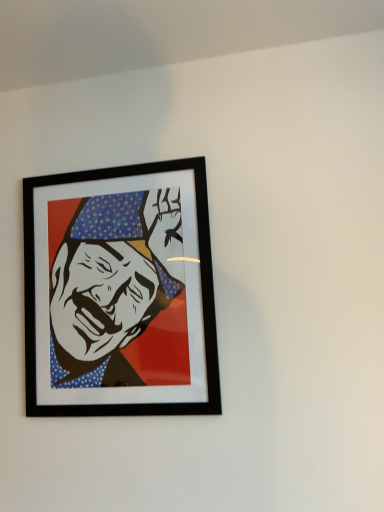
What do you see at coordinates (118, 292) in the screenshot?
I see `matte black framed artwork at upper center` at bounding box center [118, 292].

This screenshot has height=512, width=384. What are the coordinates of `matte black framed artwork at upper center` in the screenshot? It's located at (118, 292).

Locate an element on the screen. matte black framed artwork at upper center is located at coordinates (118, 292).